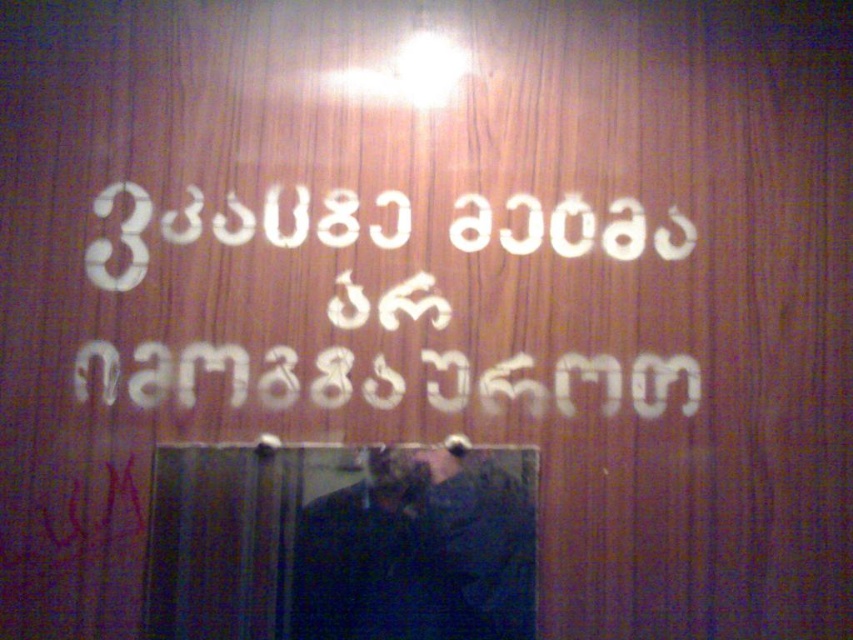
Who is shorter, white plastic sign at center or dark fabric man at center?

With less height is dark fabric man at center.

Between white plastic sign at center and dark fabric man at center, which one appears on the right side from the viewer's perspective?

From the viewer's perspective, dark fabric man at center appears more on the right side.

Between point (560, 388) and point (399, 474), which one is positioned behind?

Positioned behind is point (560, 388).

Where is `white plastic sign at center`? Image resolution: width=853 pixels, height=640 pixels. white plastic sign at center is located at coordinates (184, 372).